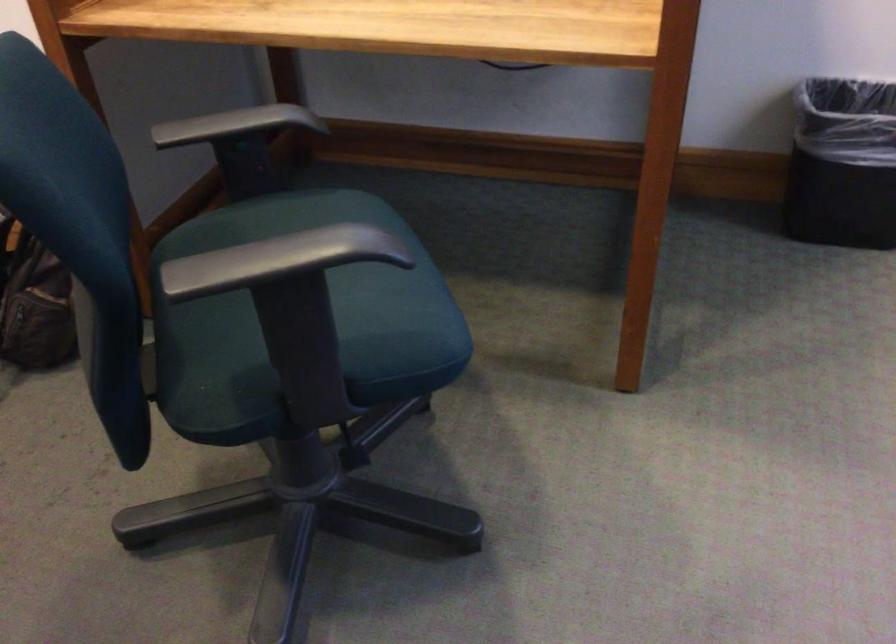
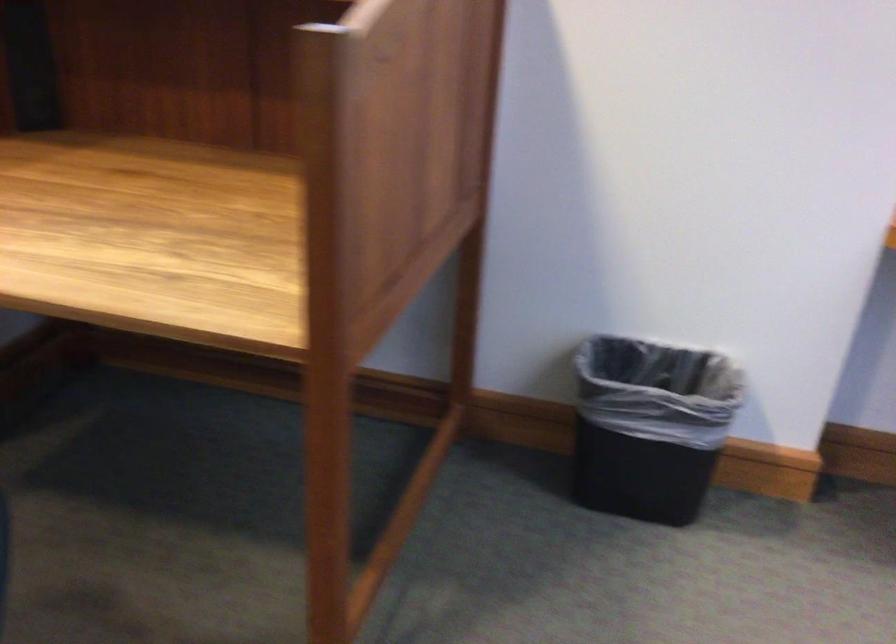
In a continuous first-person perspective shot, in which direction is the camera moving?

The movement direction of the cameraman is right, forward.